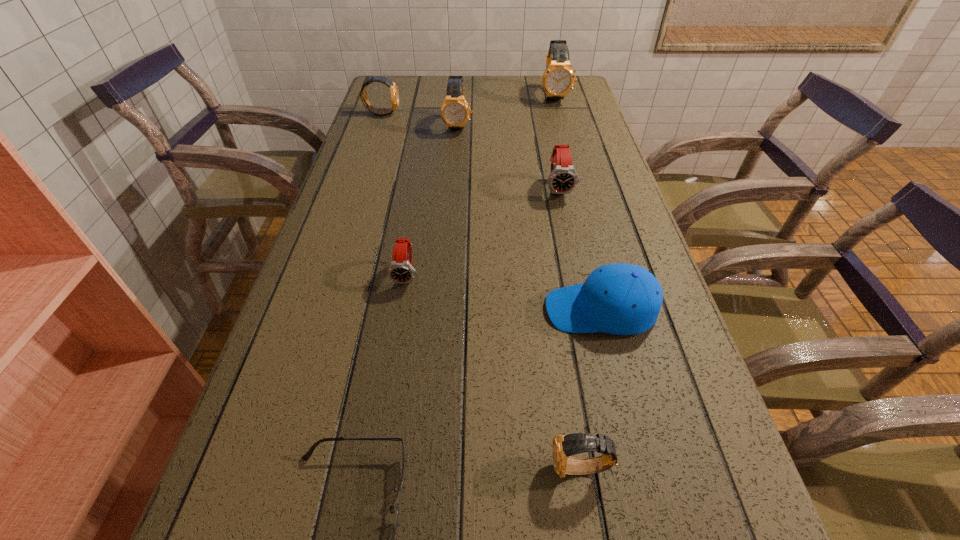
Identify the location of vacant space located 0.340m on the face of the nearest watch. The width and height of the screenshot is (960, 540). (327, 468).

This screenshot has width=960, height=540. Identify the location of vacant area located on the face of the nearest watch. (315, 468).

Find the location of a particular element. Image resolution: width=960 pixels, height=540 pixels. vacant space located on the face of the nearest watch is located at coordinates (492, 468).

Where is `vacant area situated on the face of the nearer red watch`? Image resolution: width=960 pixels, height=540 pixels. vacant area situated on the face of the nearer red watch is located at coordinates (383, 427).

At what (x,y) coordinates should I click in order to perform the action: click on object situated at the far edge. Please return your answer as a coordinate pair (x, y). This screenshot has width=960, height=540. Looking at the image, I should click on (558, 79).

Locate an element on the screen. The height and width of the screenshot is (540, 960). object positioned at the left edge is located at coordinates (394, 92).

I want to click on cap at the right edge, so click(x=622, y=299).

Find the location of a particular element. This screenshot has height=540, width=960. object that is at the far right corner is located at coordinates (558, 79).

Image resolution: width=960 pixels, height=540 pixels. What are the coordinates of `vacant area at the far edge of the desktop` in the screenshot? It's located at (528, 95).

Identify the location of vacant space at the left edge of the desktop. Image resolution: width=960 pixels, height=540 pixels. (365, 189).